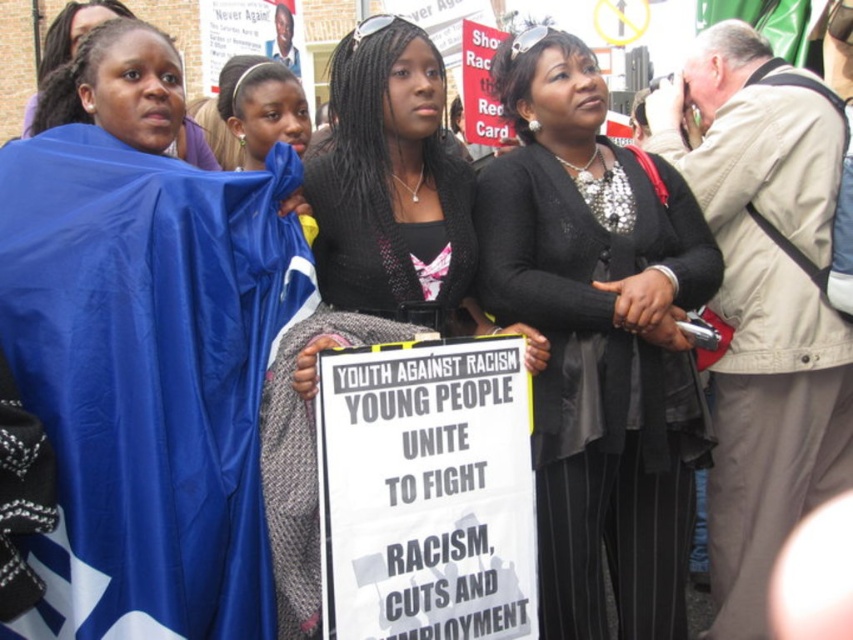
Is the position of black satin dress at center less distant than that of black fabric sign at center?

No, it is not.

Measure the distance from black satin dress at center to black fabric sign at center.

A distance of 3.83 meters exists between black satin dress at center and black fabric sign at center.

Between point (532, 109) and point (366, 326), which one is positioned in front?

Positioned in front is point (366, 326).

Identify the location of black satin dress at center. (598, 339).

Is blue fabric at left behind black fabric sign at center?

No, blue fabric at left is in front of black fabric sign at center.

Is point (131, 273) in front of point (427, 90)?

Yes, it is in front of point (427, 90).

Identify the location of blue fabric at left. This screenshot has height=640, width=853. 143,339.

Who is more forward, (x=206, y=360) or (x=682, y=349)?

Point (x=206, y=360)

Which is behind, point (117, 432) or point (680, 198)?

The point (680, 198) is behind.

Between point (149, 376) and point (599, 262), which one is positioned behind?

The point (599, 262) is more distant.

Locate an element on the screen. blue fabric at left is located at coordinates (143, 339).